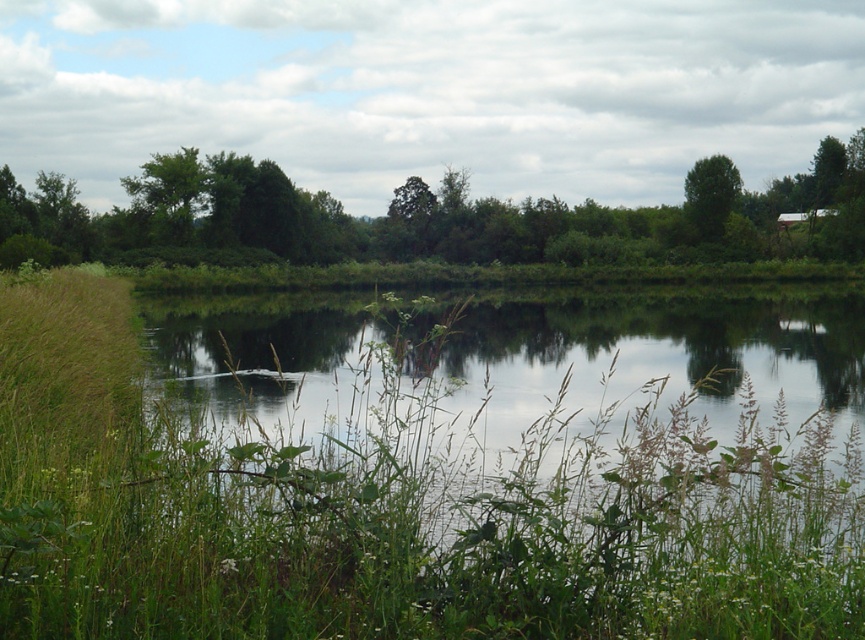
Measure the distance from green leafy tree at center to green leafy tree at upper left.

The distance of green leafy tree at center from green leafy tree at upper left is 57.93 feet.

Can you confirm if green leafy tree at center is positioned above green leafy tree at upper left?

Yes.

Image resolution: width=865 pixels, height=640 pixels. What do you see at coordinates (425, 218) in the screenshot?
I see `green leafy tree at center` at bounding box center [425, 218].

Locate an element on the screen. green leafy tree at center is located at coordinates (425, 218).

Can you confirm if transparent water at center is shorter than green leafy tree at upper left?

Yes.

Who is more forward, (485, 321) or (180, 180)?

Point (485, 321) is more forward.

Who is more distant from viewer, (817, 401) or (168, 170)?

Point (168, 170)

Where is `transparent water at center`? transparent water at center is located at coordinates (638, 356).

Is transparent water at center to the right of green leafy tree at center from the viewer's perspective?

In fact, transparent water at center is to the left of green leafy tree at center.

Is transparent water at center further to camera compared to green leafy tree at center?

No, transparent water at center is closer to the viewer.

You are a GUI agent. You are given a task and a screenshot of the screen. Output one action in this format:
    pyautogui.click(x=<x>, y=<y>)
    Task: Click on the transparent water at center
    This screenshot has height=640, width=865.
    Given the screenshot: What is the action you would take?
    pyautogui.click(x=638, y=356)